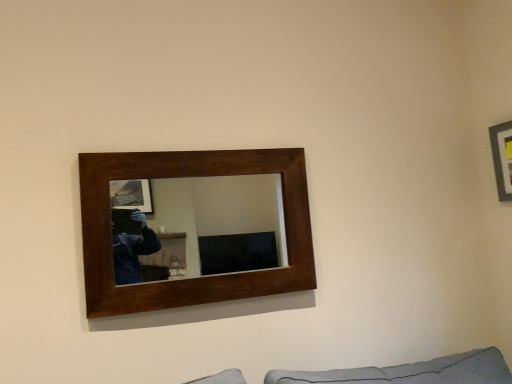
Question: From a real-world perspective, is wooden picture frame at upper right, acting as the first picture frame starting from the right, located higher than dark wood/matte picture frame at upper center, the first picture frame positioned from the left?

Choices:
 (A) no
 (B) yes

Answer: (B)

Question: Is the position of wooden picture frame at upper right, acting as the 2th picture frame starting from the left, more distant than that of dark wood/matte picture frame at upper center, the 2th picture frame in the right-to-left sequence?

Choices:
 (A) yes
 (B) no

Answer: (A)

Question: Considering the relative positions of wooden picture frame at upper right, acting as the 2th picture frame starting from the left, and dark wood/matte picture frame at upper center, the first picture frame positioned from the left, in the image provided, is wooden picture frame at upper right, acting as the 2th picture frame starting from the left, to the left of dark wood/matte picture frame at upper center, the first picture frame positioned from the left, from the viewer's perspective?

Choices:
 (A) yes
 (B) no

Answer: (B)

Question: Considering the relative positions of wooden picture frame at upper right, acting as the first picture frame starting from the right, and dark wood/matte picture frame at upper center, the first picture frame positioned from the left, in the image provided, is wooden picture frame at upper right, acting as the first picture frame starting from the right, to the right of dark wood/matte picture frame at upper center, the first picture frame positioned from the left, from the viewer's perspective?

Choices:
 (A) yes
 (B) no

Answer: (A)

Question: From a real-world perspective, is wooden picture frame at upper right, acting as the first picture frame starting from the right, positioned under dark wood/matte picture frame at upper center, the 2th picture frame in the right-to-left sequence, based on gravity?

Choices:
 (A) no
 (B) yes

Answer: (A)

Question: Does wooden picture frame at upper right, acting as the 2th picture frame starting from the left, have a smaller size compared to dark wood/matte picture frame at upper center, the 2th picture frame in the right-to-left sequence?

Choices:
 (A) no
 (B) yes

Answer: (B)

Question: Is dark wood/matte picture frame at upper center, the first picture frame positioned from the left, bigger than wooden picture frame at upper right, acting as the first picture frame starting from the right?

Choices:
 (A) yes
 (B) no

Answer: (A)

Question: Is dark wood/matte picture frame at upper center, the 2th picture frame in the right-to-left sequence, located outside wooden picture frame at upper right, acting as the first picture frame starting from the right?

Choices:
 (A) no
 (B) yes

Answer: (B)

Question: Can you confirm if dark wood/matte picture frame at upper center, the 2th picture frame in the right-to-left sequence, is positioned to the left of wooden picture frame at upper right, acting as the 2th picture frame starting from the left?

Choices:
 (A) yes
 (B) no

Answer: (A)

Question: Is dark wood/matte picture frame at upper center, the first picture frame positioned from the left, taller than wooden picture frame at upper right, acting as the 2th picture frame starting from the left?

Choices:
 (A) no
 (B) yes

Answer: (B)

Question: Is dark wood/matte picture frame at upper center, the first picture frame positioned from the left, shorter than wooden picture frame at upper right, acting as the first picture frame starting from the right?

Choices:
 (A) no
 (B) yes

Answer: (A)

Question: Is dark wood/matte picture frame at upper center, the first picture frame positioned from the left, at the right side of wooden picture frame at upper right, acting as the 2th picture frame starting from the left?

Choices:
 (A) yes
 (B) no

Answer: (B)

Question: Is wooden picture frame at upper right, acting as the 2th picture frame starting from the left, taller or shorter than dark wood/matte picture frame at upper center, the 2th picture frame in the right-to-left sequence?

Choices:
 (A) short
 (B) tall

Answer: (A)